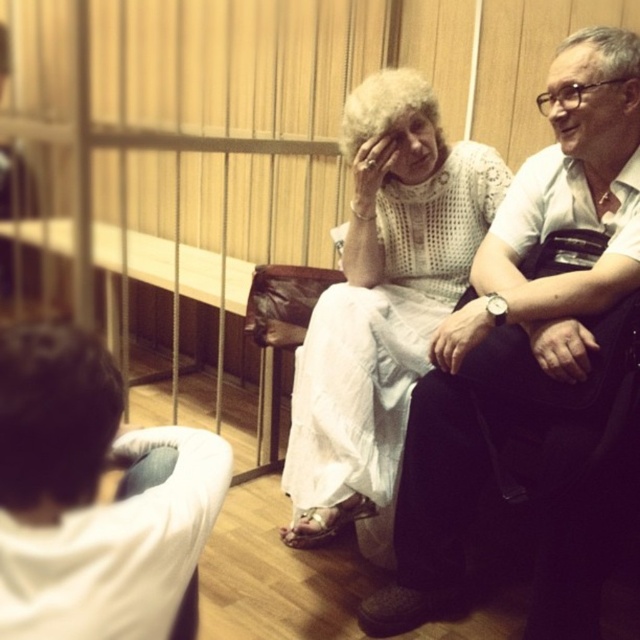
Is white fabric shirt at upper right closer to camera compared to white lace dress at center?

Yes, it is in front of white lace dress at center.

Between white fabric shirt at upper right and white lace dress at center, which one is positioned lower?

Positioned lower is white fabric shirt at upper right.

The width and height of the screenshot is (640, 640). Find the location of `white fabric shirt at upper right`. white fabric shirt at upper right is located at coordinates (518, 316).

This screenshot has height=640, width=640. Describe the element at coordinates (518, 316) in the screenshot. I see `white fabric shirt at upper right` at that location.

Where is `white fabric shirt at upper right`? Image resolution: width=640 pixels, height=640 pixels. white fabric shirt at upper right is located at coordinates (518, 316).

Locate an element on the screen. The height and width of the screenshot is (640, 640). white fabric shirt at upper right is located at coordinates (518, 316).

Is white lace dress at center positioned at the back of dark brown hair at lower left?

Yes, white lace dress at center is behind dark brown hair at lower left.

Is point (440, 160) positioned in front of point (109, 368)?

That is False.

Identify the location of white lace dress at center. Image resolution: width=640 pixels, height=640 pixels. (381, 305).